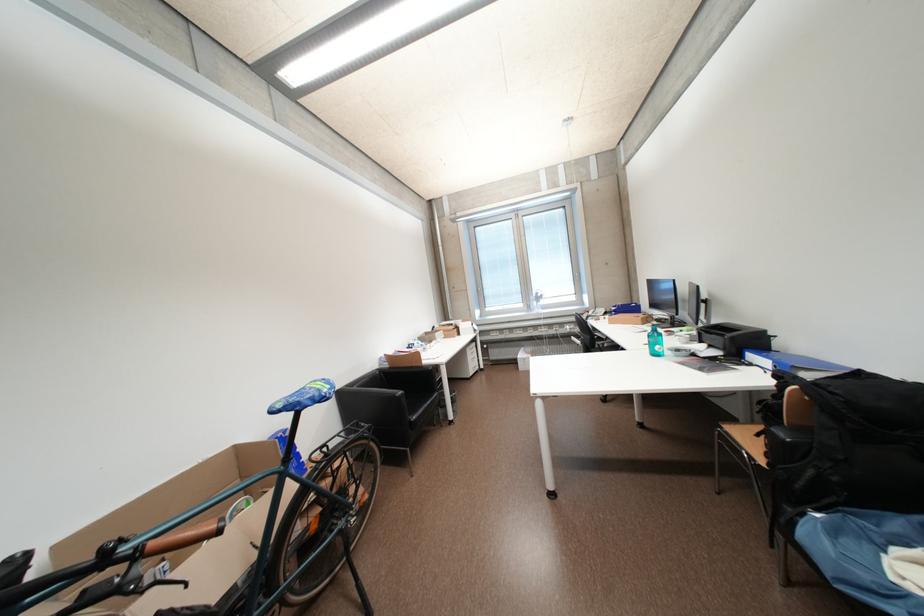
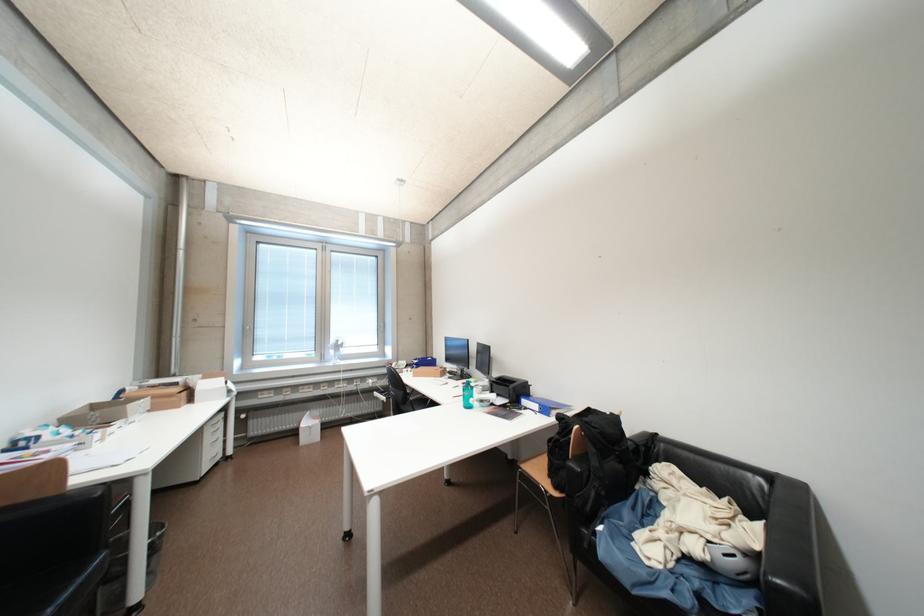
In the second image, find the point that corresponds to (581,341) in the first image.

(383, 395)